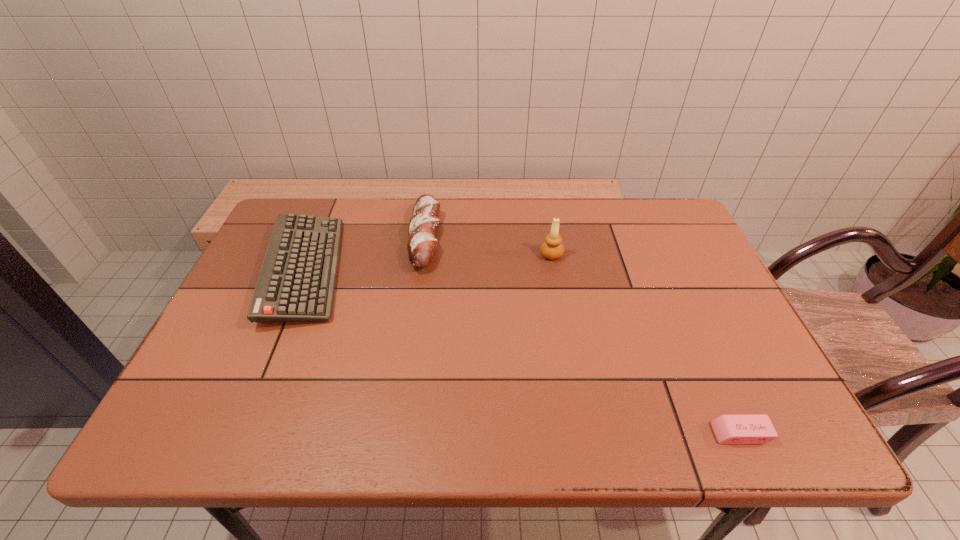
Identify the location of free spot at the right edge of the desktop. (722, 372).

This screenshot has height=540, width=960. What are the coordinates of `vacant area at the near left corner of the desktop` in the screenshot? It's located at (241, 411).

Locate an element on the screen. This screenshot has height=540, width=960. free space at the near right corner of the desktop is located at coordinates (789, 433).

In order to click on vacant area that lies between the candle_holder and the baguet in this screenshot , I will do `click(488, 246)`.

The width and height of the screenshot is (960, 540). Find the location of `blank region between the second object from left to right and the candle_holder`. blank region between the second object from left to right and the candle_holder is located at coordinates click(488, 246).

The width and height of the screenshot is (960, 540). Find the location of `free space between the second object from right to left and the baguet`. free space between the second object from right to left and the baguet is located at coordinates (488, 246).

Where is `free point between the nearest object and the third tallest object`? free point between the nearest object and the third tallest object is located at coordinates (522, 352).

Where is `unoccupied position between the rightmost object and the second object from left to right`? This screenshot has width=960, height=540. unoccupied position between the rightmost object and the second object from left to right is located at coordinates (583, 335).

Identify the location of vacant area between the rightmost object and the baguet. (583, 335).

Image resolution: width=960 pixels, height=540 pixels. In order to click on free space between the third object from right to left and the eraser in this screenshot , I will do `click(583, 335)`.